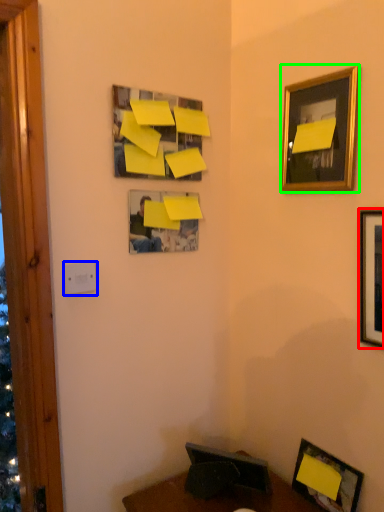
Question: Which object is positioned closest to picture frame (highlighted by a red box)? Select from light switch (highlighted by a blue box) and picture frame (highlighted by a green box).

Choices:
 (A) light switch
 (B) picture frame

Answer: (B)